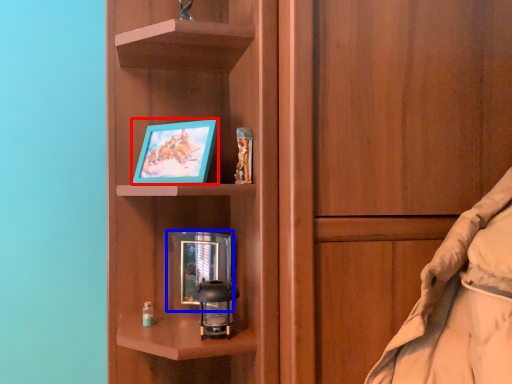
Question: Which of the following is the closest to the observer, picture frame (highlighted by a red box) or picture frame (highlighted by a blue box)?

Choices:
 (A) picture frame
 (B) picture frame

Answer: (A)